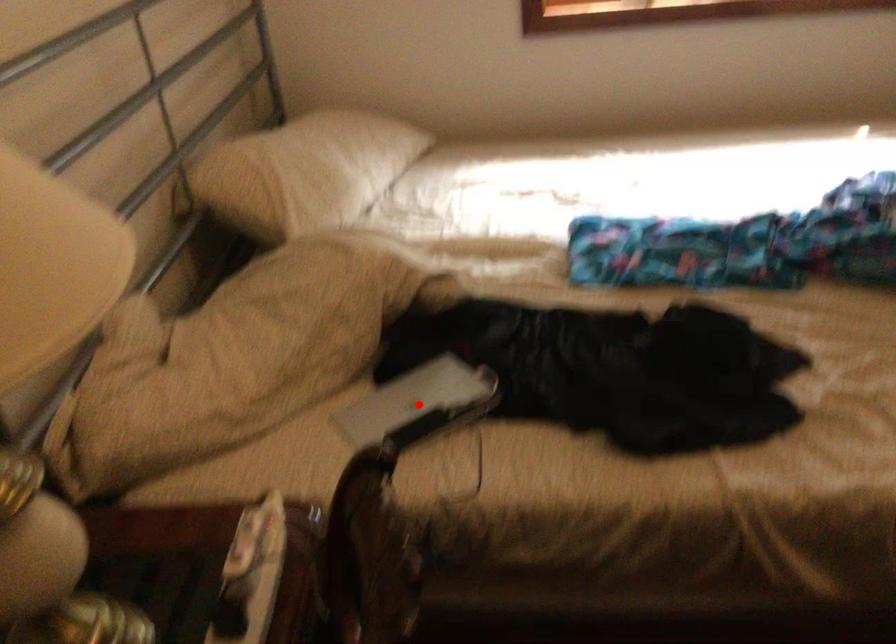
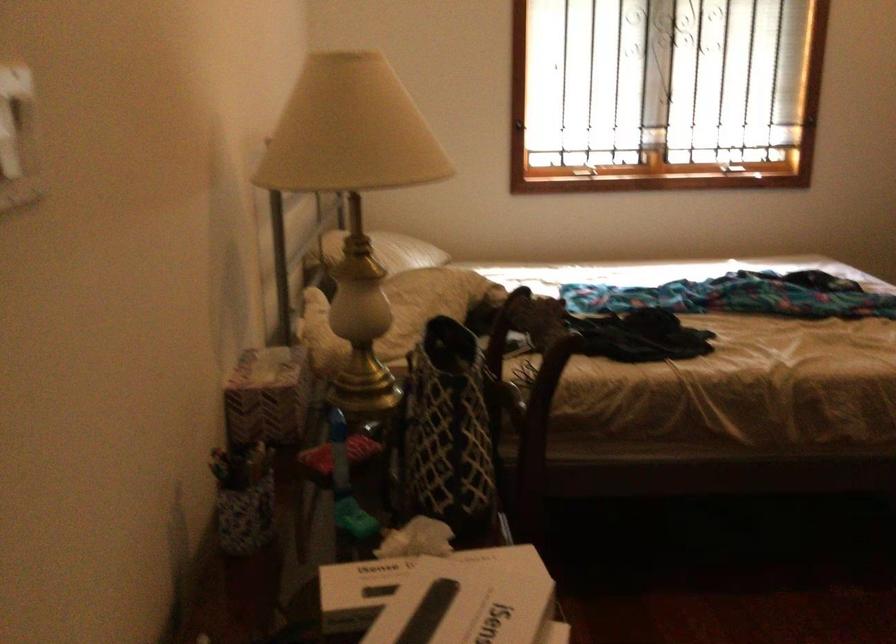
Question: I am providing you with two images of the same scene from different viewpoints. A red point is marked on the first image. Is the red point's position out of view in image 2?

Choices:
 (A) Yes
 (B) No

Answer: (A)